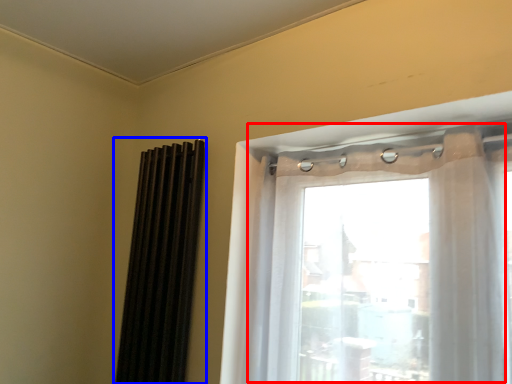
Question: Which object appears farthest to the camera in this image, window (highlighted by a red box) or shutter (highlighted by a blue box)?

Choices:
 (A) window
 (B) shutter

Answer: (B)